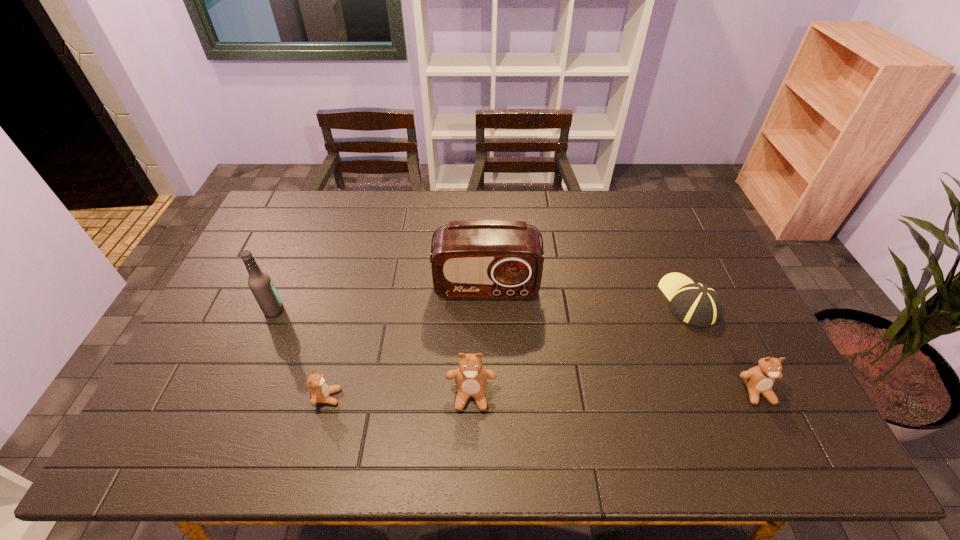
Where is `vacant space that's between the shortest object and the radio receiver`? The width and height of the screenshot is (960, 540). vacant space that's between the shortest object and the radio receiver is located at coordinates (588, 294).

Where is `free space that is in between the radio receiver and the second teddy bear from right to left`? free space that is in between the radio receiver and the second teddy bear from right to left is located at coordinates (479, 342).

Identify the location of free space that is in between the fourth tallest object and the fifth object from right to left. (542, 394).

I want to click on object that is the third closest one to the leftmost teddy bear, so click(x=471, y=259).

Where is `object that is the second closest to the shortest teddy bear`? The height and width of the screenshot is (540, 960). object that is the second closest to the shortest teddy bear is located at coordinates (471, 378).

Locate an element on the screen. The height and width of the screenshot is (540, 960). teddy bear that is the second closest one to the second tallest teddy bear is located at coordinates (320, 392).

Locate which teddy bear is the closest to the second object from left to right. Please provide its 2D coordinates. Your answer should be formatted as a tuple, i.e. [(x, y)], where the tuple contains the x and y coordinates of a point satisfying the conditions above.

[(471, 378)]

Identify the location of vacant area in the image that satisfies the following two spatial constraints: 1. on the front-facing side of the rightmost teddy bear; 2. on the front-facing side of the fifth object from right to left. (759, 397).

Where is `vacant space that satisfies the following two spatial constraints: 1. on the front-facing side of the fourth shortest object; 2. on the front-facing side of the leftmost teddy bear`? The width and height of the screenshot is (960, 540). vacant space that satisfies the following two spatial constraints: 1. on the front-facing side of the fourth shortest object; 2. on the front-facing side of the leftmost teddy bear is located at coordinates (471, 397).